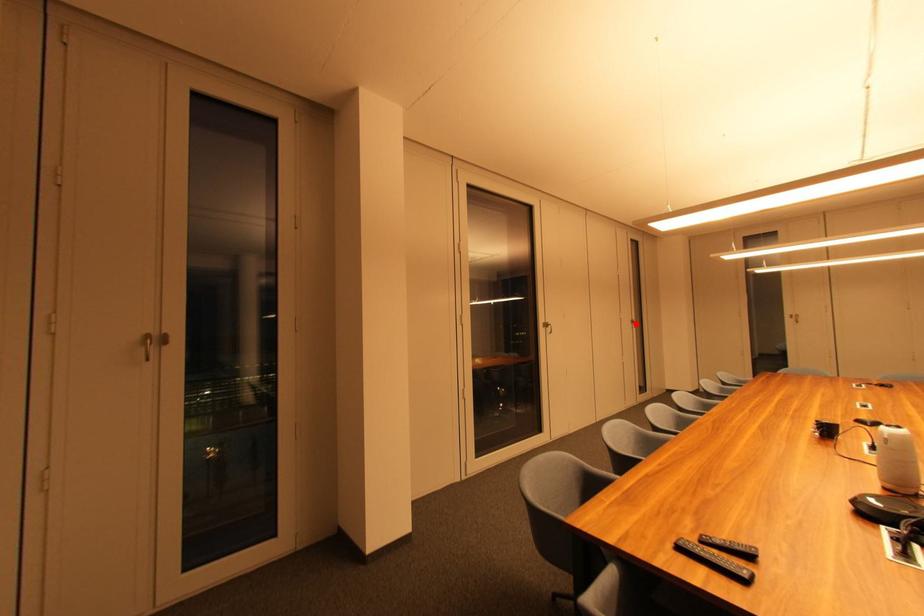
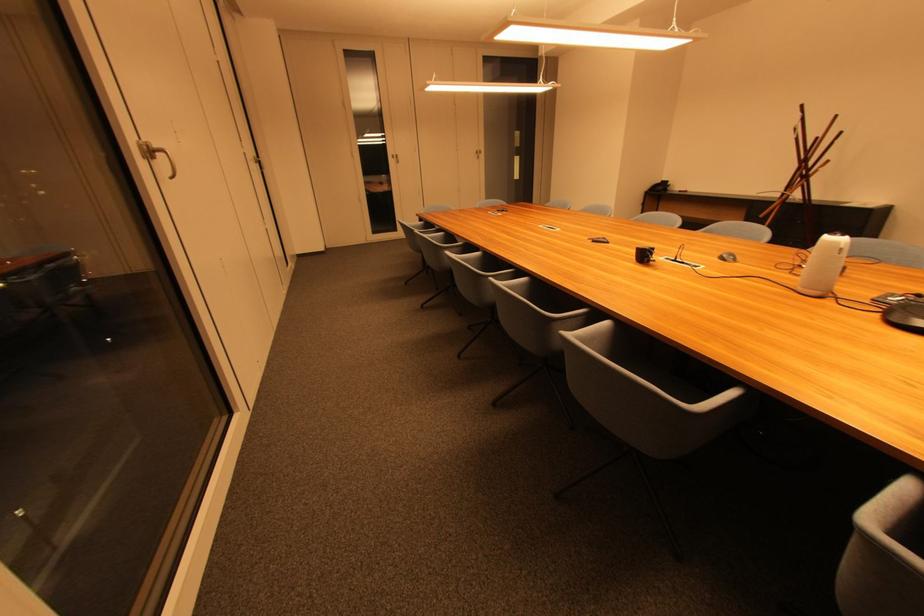
In the second image, find the point that corresponds to the highlighted location in the first image.

(259, 163)